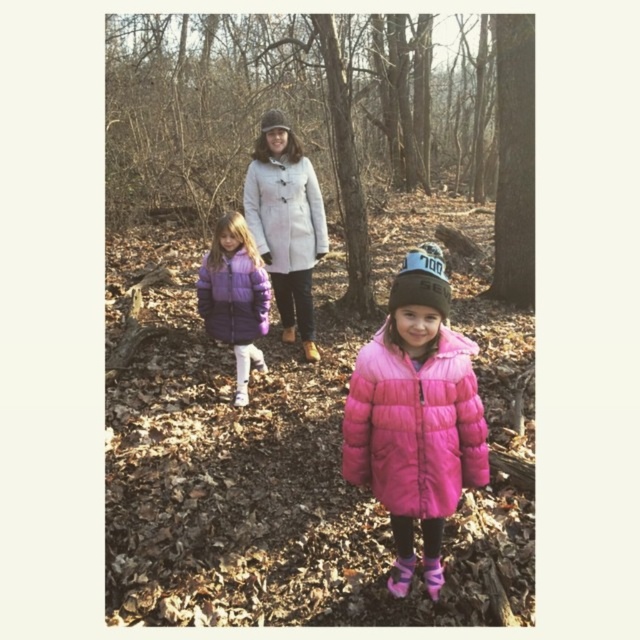
Does point (204, 272) come closer to viewer compared to point (284, 339)?

Yes, point (204, 272) is closer to viewer.

Is purple down jacket at center in front of brown suede boot at center?

That is True.

Which is in front, point (243, 264) or point (294, 336)?

Point (243, 264)

The image size is (640, 640). What are the coordinates of `purple down jacket at center` in the screenshot? It's located at (234, 298).

Can you confirm if leather boot at center is positioned to the right of brown suede boot at center?

Yes, leather boot at center is to the right of brown suede boot at center.

Does leather boot at center appear over brown suede boot at center?

No.

Is point (316, 358) closer to camera compared to point (284, 333)?

Yes, it is in front of point (284, 333).

You are a GUI agent. You are given a task and a screenshot of the screen. Output one action in this format:
    pyautogui.click(x=<x>, y=<y>)
    Task: Click on the leather boot at center
    This screenshot has height=640, width=640.
    Given the screenshot: What is the action you would take?
    pyautogui.click(x=310, y=352)

Is white woolen coat at center to the right of pink matte boot at lower right from the viewer's perspective?

No, white woolen coat at center is not to the right of pink matte boot at lower right.

Who is positioned more to the left, white woolen coat at center or pink matte boot at lower right?

white woolen coat at center

Is point (276, 244) positioned behind point (442, 573)?

Yes, it is.

Find the location of a particular element. The height and width of the screenshot is (640, 640). white woolen coat at center is located at coordinates (285, 212).